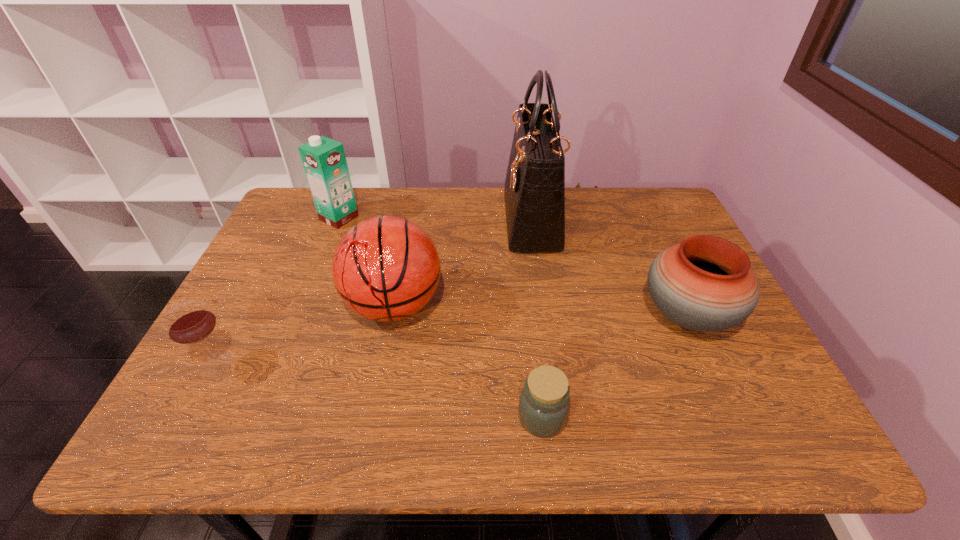
Find the location of a particular element. This screenshot has width=960, height=540. empty location between the pottery and the nearest object is located at coordinates (614, 366).

Locate an element on the screen. The height and width of the screenshot is (540, 960). free spot between the jar and the fifth object from right to left is located at coordinates (441, 318).

Identify the location of vacant area that lies between the wineglass and the third object from left to right. 305,334.

Image resolution: width=960 pixels, height=540 pixels. What are the coordinates of `vacant area that lies between the jar and the second shortest object` in the screenshot? It's located at (379, 390).

You are a GUI agent. You are given a task and a screenshot of the screen. Output one action in this format:
    pyautogui.click(x=<x>, y=<y>)
    Task: Click on the unoccupied position between the fourth object from right to left and the shortest object
    
    Given the screenshot: What is the action you would take?
    pyautogui.click(x=468, y=361)

You are a GUI agent. You are given a task and a screenshot of the screen. Output one action in this format:
    pyautogui.click(x=<x>, y=<y>)
    Task: Click on the vacant region between the fifth object from right to left and the handbag
    This screenshot has width=960, height=540.
    Given the screenshot: What is the action you would take?
    pyautogui.click(x=435, y=219)

The height and width of the screenshot is (540, 960). In order to click on free spot between the handbag and the shortest object in this screenshot , I will do `click(537, 319)`.

Identify the location of free space between the handbag and the jar. The width and height of the screenshot is (960, 540). [x=537, y=319].

Choose which object is the second nearest neighbor to the leftmost object. Please provide its 2D coordinates. Your answer should be formatted as a tuple, i.e. [(x, y)], where the tuple contains the x and y coordinates of a point satisfying the conditions above.

[(324, 160)]

Locate an element on the screen. This screenshot has height=540, width=960. the fourth closest object relative to the handbag is located at coordinates [x=324, y=160].